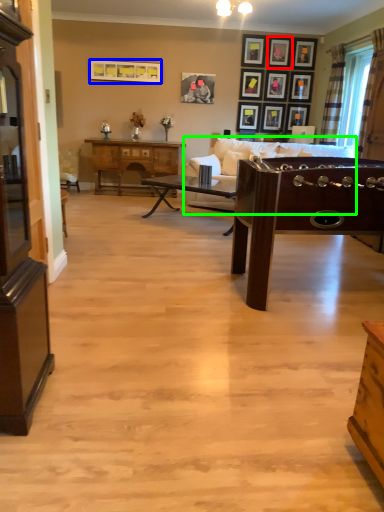
Question: Considering the real-world distances, which object is farthest from picture frame (highlighted by a red box)? picture frame (highlighted by a blue box) or studio couch (highlighted by a green box)?

Choices:
 (A) picture frame
 (B) studio couch

Answer: (A)